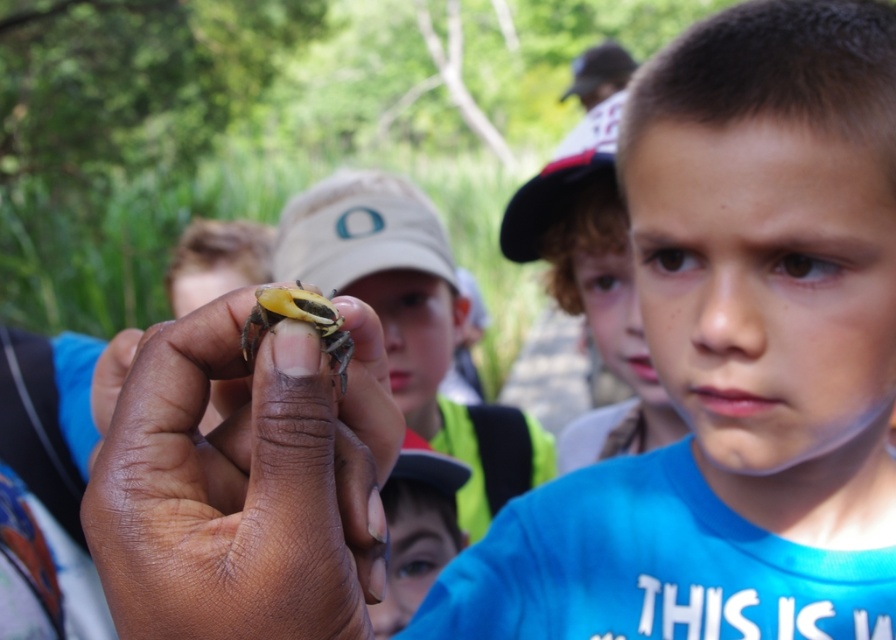
Who is lower down, smooth yellow frog at center or curly-haired boy at center?

curly-haired boy at center

Between smooth yellow frog at center and curly-haired boy at center, which one appears on the right side from the viewer's perspective?

curly-haired boy at center

This screenshot has width=896, height=640. What do you see at coordinates (411, 323) in the screenshot?
I see `smooth yellow frog at center` at bounding box center [411, 323].

This screenshot has height=640, width=896. In order to click on smooth yellow frog at center in this screenshot , I will do `click(411, 323)`.

Is curly-haired boy at center shorter than smooth skin face at center?

No.

Describe the element at coordinates (592, 296) in the screenshot. I see `curly-haired boy at center` at that location.

Is point (558, 212) behind point (385, 609)?

Yes, point (558, 212) is farther from viewer.

Locate an element on the screen. curly-haired boy at center is located at coordinates (592, 296).

From the picture: Does blue matte shirt at center have a larger size compared to smooth skin face at center?

Indeed, blue matte shirt at center has a larger size compared to smooth skin face at center.

Who is shorter, blue matte shirt at center or smooth skin face at center?

smooth skin face at center

What do you see at coordinates (734, 358) in the screenshot?
I see `blue matte shirt at center` at bounding box center [734, 358].

I want to click on blue matte shirt at center, so click(x=734, y=358).